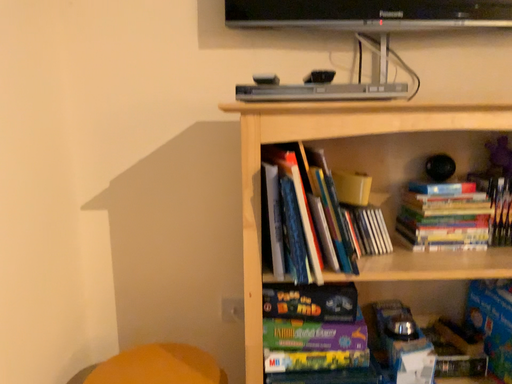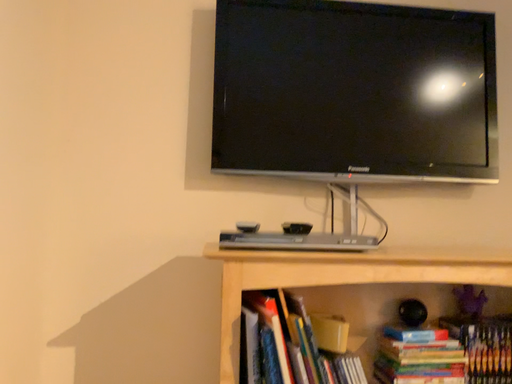
Question: Which way did the camera rotate in the video?

Choices:
 (A) rotated upward
 (B) rotated downward

Answer: (A)